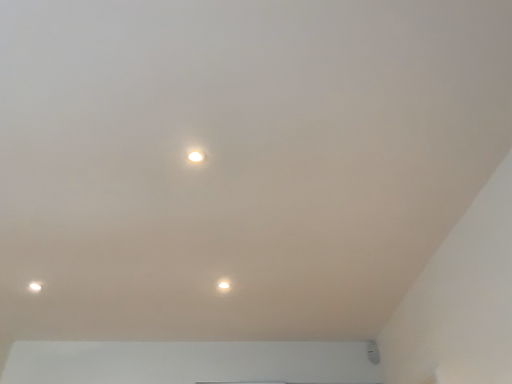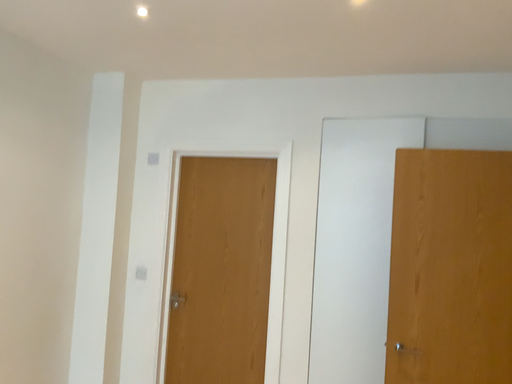
Question: How did the camera likely rotate when shooting the video?

Choices:
 (A) rotated downward
 (B) rotated upward

Answer: (A)